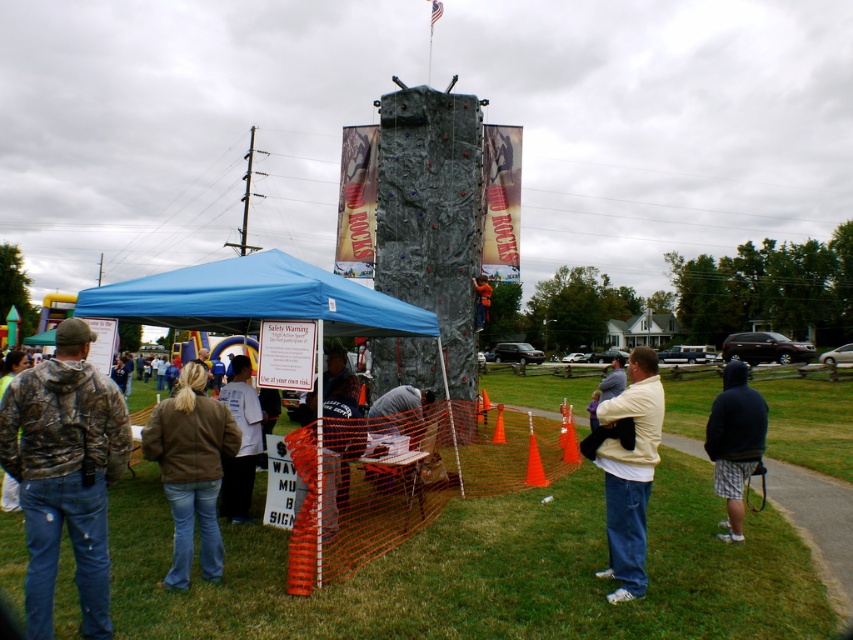
You are a photographer at the event and want to capture a photo of the two people wearing the dark blue hoodie at center and the white cotton shirt at center. Which clothing item is shorter in height?

The dark blue hoodie at center has a lesser height compared to the white cotton shirt at center, so the dark blue hoodie at center is shorter in height.

You are standing at the origin point of the coordinate system. You want to move towards the blue fabric canopy at center. What direction should you move in?

The blue fabric canopy at center is located at point (254, 300), so you should move northeast to reach it.